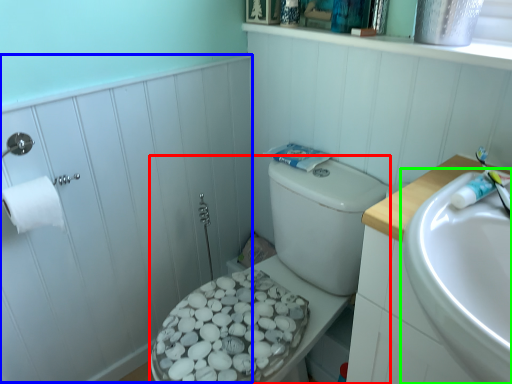
Question: Which object is the closest to the porcelain (highlighted by a red box)? Choose among these: side (highlighted by a blue box) or sink (highlighted by a green box).

Choices:
 (A) side
 (B) sink

Answer: (A)